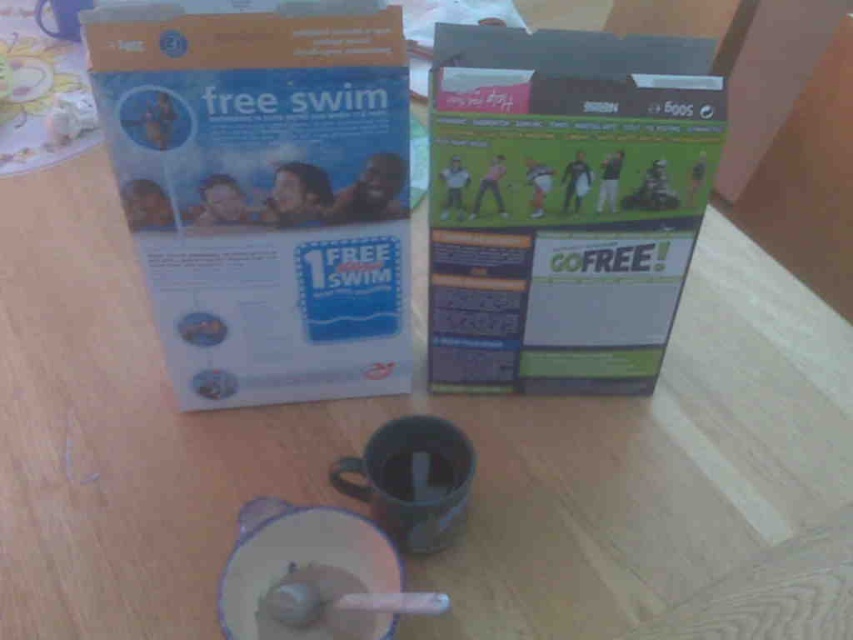
Where is `matte white cardboard box at upper left`? The height and width of the screenshot is (640, 853). matte white cardboard box at upper left is located at coordinates click(x=263, y=195).

Does matte white cardboard box at upper left have a greater height compared to matte green cardboard box at center?

No, matte white cardboard box at upper left is not taller than matte green cardboard box at center.

Identify the location of matte white cardboard box at upper left. (263, 195).

You are a GUI agent. You are given a task and a screenshot of the screen. Output one action in this format:
    pyautogui.click(x=<x>, y=<y>)
    Task: Click on the matte white cardboard box at upper left
    The width and height of the screenshot is (853, 640).
    Given the screenshot: What is the action you would take?
    pyautogui.click(x=263, y=195)